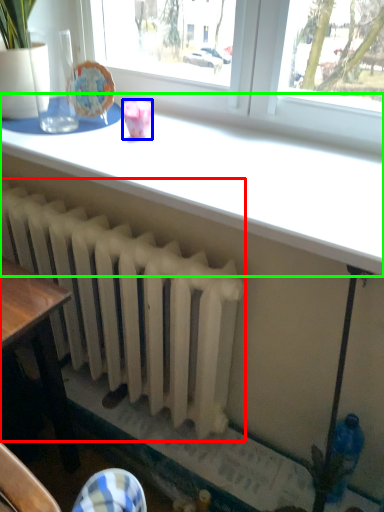
Question: Which is nearer to the radiator (highlighted by a red box)? tableware (highlighted by a blue box) or table (highlighted by a green box).

Choices:
 (A) tableware
 (B) table

Answer: (B)